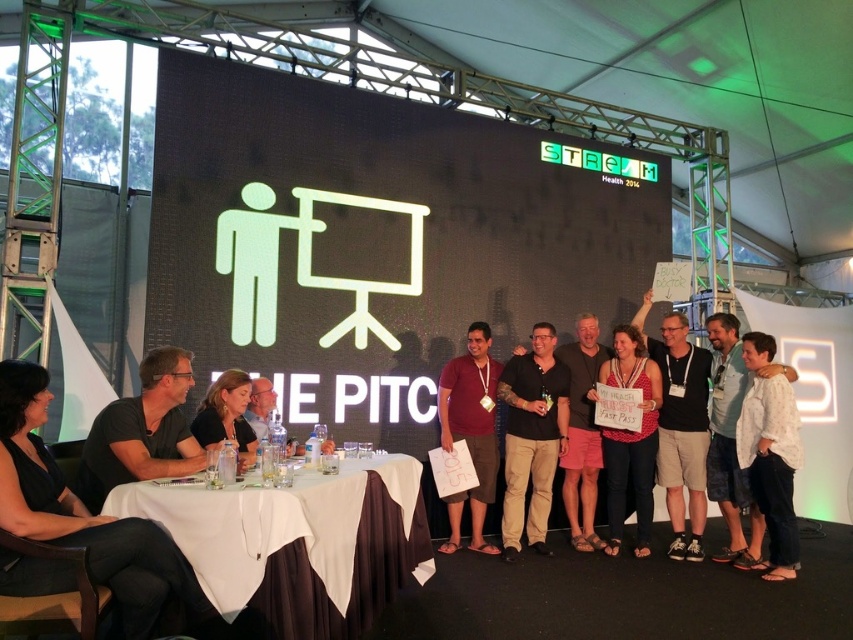
You are standing at the center of the tent and want to move towards the point that is closer to you. Which point should you move towards, point (780, 477) or point (251, 422)?

Point (251, 422) is closer to you because it is less further to the viewer than point (780, 477).